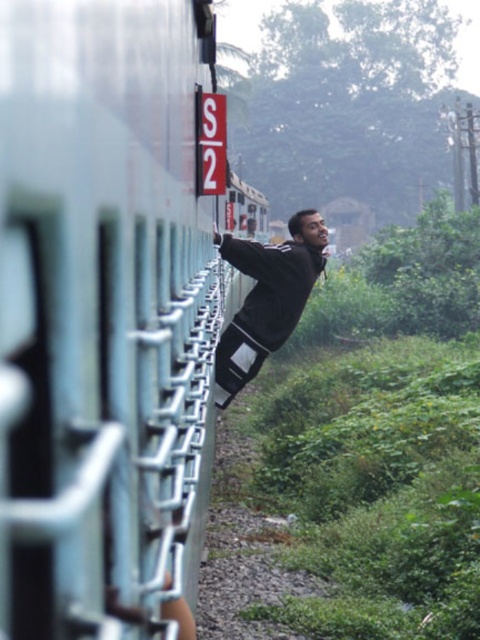
Based on the photo, is metallic silver train at center positioned behind dark gray jacket at center?

No, metallic silver train at center is in front of dark gray jacket at center.

Measure the distance between point (100, 1) and camera.

Point (100, 1) and camera are 57.60 centimeters apart.

You are a GUI agent. You are given a task and a screenshot of the screen. Output one action in this format:
    pyautogui.click(x=<x>, y=<y>)
    Task: Click on the metallic silver train at center
    This screenshot has height=640, width=480.
    Given the screenshot: What is the action you would take?
    pyautogui.click(x=105, y=314)